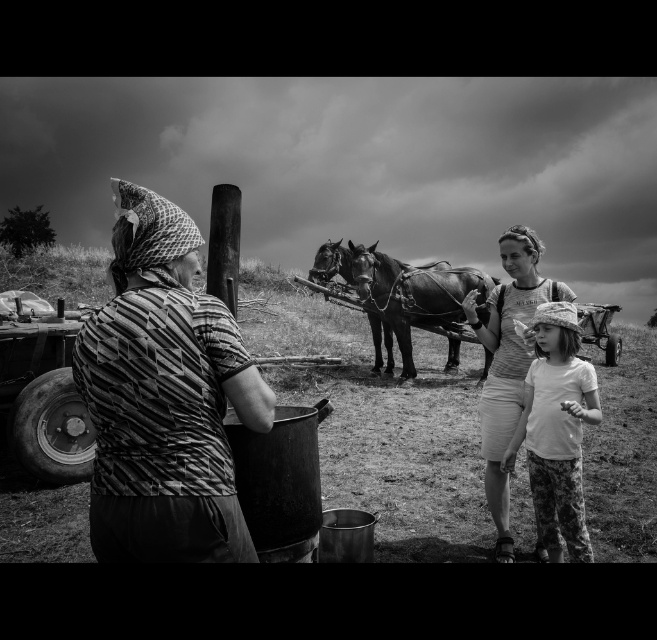
Is striped fabric at center closer to the viewer compared to smooth leather horse at center?

Yes, it is.

Which of these two, striped fabric at center or smooth leather horse at center, stands taller?

smooth leather horse at center is taller.

Measure the distance between striped fabric at center and camera.

striped fabric at center is 1.49 meters away from camera.

The width and height of the screenshot is (657, 640). I want to click on striped fabric at center, so click(x=164, y=397).

Does striped fabric at center appear on the right side of white cotton shirt at lower right?

In fact, striped fabric at center is to the left of white cotton shirt at lower right.

In the scene shown: Who is more forward, [240,413] or [514,449]?

Point [240,413]

What do you see at coordinates (164, 397) in the screenshot? The width and height of the screenshot is (657, 640). I see `striped fabric at center` at bounding box center [164, 397].

The height and width of the screenshot is (640, 657). I want to click on striped fabric at center, so click(x=164, y=397).

Is point (549, 396) more distant than point (407, 273)?

No, (549, 396) is in front of (407, 273).

In order to click on white cotton shirt at lower right in this screenshot , I will do `click(556, 429)`.